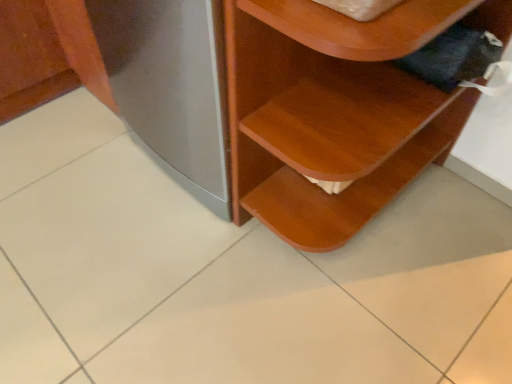
What do you see at coordinates (331, 113) in the screenshot?
I see `wooden shelf at center` at bounding box center [331, 113].

The image size is (512, 384). I want to click on wooden shelf at center, so click(331, 113).

Locate an element on the screen. wooden shelf at center is located at coordinates (331, 113).